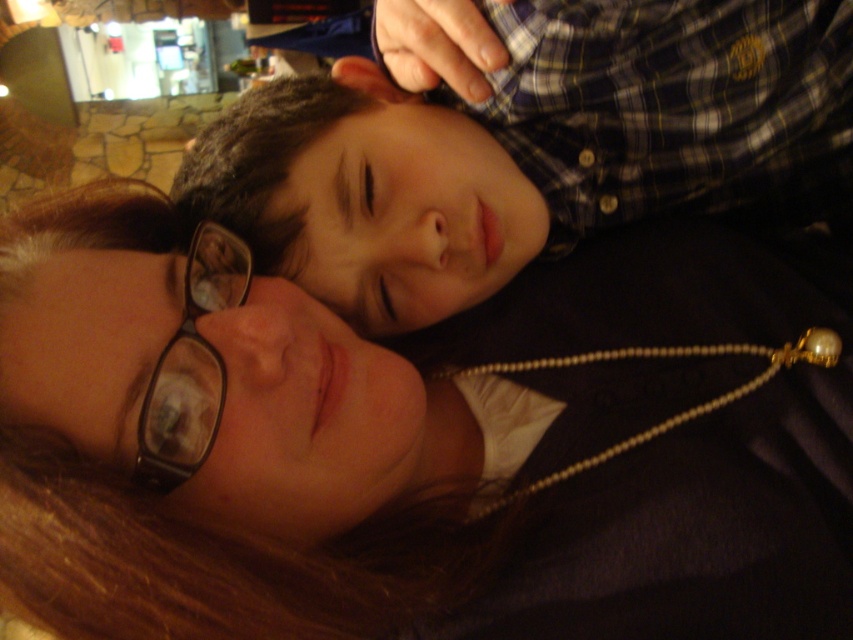
Question: Which of the following is the farthest from the observer?

Choices:
 (A) (225, 273)
 (B) (766, 282)
 (C) (432, 118)

Answer: (B)

Question: Can you confirm if brown hair at upper center is positioned above black plastic glasses at lower left?

Choices:
 (A) no
 (B) yes

Answer: (A)

Question: Which point is closer to the camera?

Choices:
 (A) (152, 442)
 (B) (403, 600)
 (C) (426, 321)

Answer: (A)

Question: Which point appears farthest from the camera in this image?

Choices:
 (A) (38, 221)
 (B) (206, 131)

Answer: (B)

Question: Does brown hair at upper center have a larger size compared to plaid shirt at upper center?

Choices:
 (A) yes
 (B) no

Answer: (A)

Question: Can you confirm if plaid shirt at upper center is smaller than black plastic glasses at lower left?

Choices:
 (A) yes
 (B) no

Answer: (B)